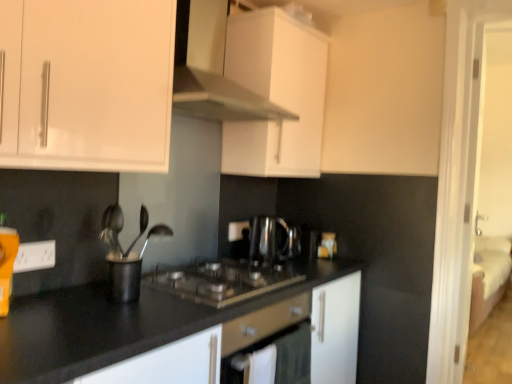
Question: Can you confirm if black granite countertop at center is smaller than white plastic electrical outlet at lower left?

Choices:
 (A) yes
 (B) no

Answer: (B)

Question: Considering the relative sizes of black granite countertop at center and white plastic electrical outlet at lower left in the image provided, is black granite countertop at center bigger than white plastic electrical outlet at lower left?

Choices:
 (A) yes
 (B) no

Answer: (A)

Question: From a real-world perspective, is black granite countertop at center positioned over white plastic electrical outlet at lower left based on gravity?

Choices:
 (A) yes
 (B) no

Answer: (B)

Question: From a real-world perspective, is black granite countertop at center under white plastic electrical outlet at lower left?

Choices:
 (A) no
 (B) yes

Answer: (B)

Question: From the image's perspective, is black granite countertop at center on white plastic electrical outlet at lower left?

Choices:
 (A) no
 (B) yes

Answer: (A)

Question: Is black granite countertop at center bigger or smaller than polished metal spoon at center?

Choices:
 (A) small
 (B) big

Answer: (B)

Question: From the image's perspective, is black granite countertop at center above or below polished metal spoon at center?

Choices:
 (A) above
 (B) below

Answer: (B)

Question: Does point (220, 316) appear closer or farther from the camera than point (139, 228)?

Choices:
 (A) farther
 (B) closer

Answer: (B)

Question: Is black granite countertop at center situated inside polished metal spoon at center or outside?

Choices:
 (A) inside
 (B) outside

Answer: (B)

Question: From the image's perspective, relative to black granite countertop at center, is white glossy cabinet at upper center, the 2th cabinetry in the back-to-front sequence, above or below?

Choices:
 (A) above
 (B) below

Answer: (A)

Question: Do you think white glossy cabinet at upper center, positioned as the second cabinetry in front-to-back order, is within black granite countertop at center, or outside of it?

Choices:
 (A) inside
 (B) outside

Answer: (B)

Question: Looking at their shapes, would you say white glossy cabinet at upper center, positioned as the second cabinetry in front-to-back order, is wider or thinner than black granite countertop at center?

Choices:
 (A) wide
 (B) thin

Answer: (B)

Question: Is point click(x=204, y=97) closer or farther from the camera than point click(x=147, y=329)?

Choices:
 (A) farther
 (B) closer

Answer: (A)

Question: Is white glossy cabinet at upper center, the 2th cabinetry in the back-to-front sequence, situated inside white matte cabinet at upper center, which is the third cabinetry from front to back, or outside?

Choices:
 (A) inside
 (B) outside

Answer: (B)

Question: From the image's perspective, is white glossy cabinet at upper center, the 2th cabinetry in the back-to-front sequence, located above or below white matte cabinet at upper center, which is the third cabinetry from front to back?

Choices:
 (A) below
 (B) above

Answer: (B)